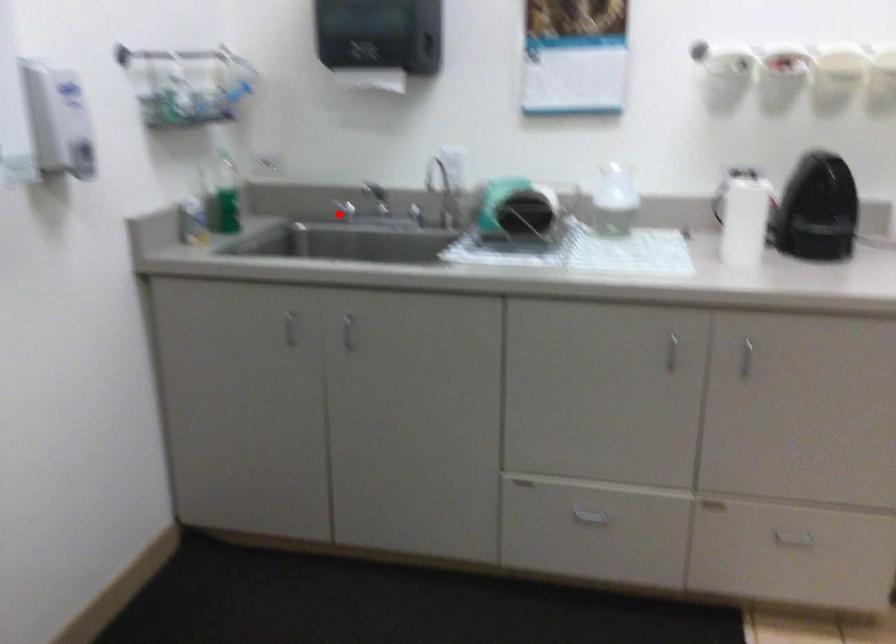
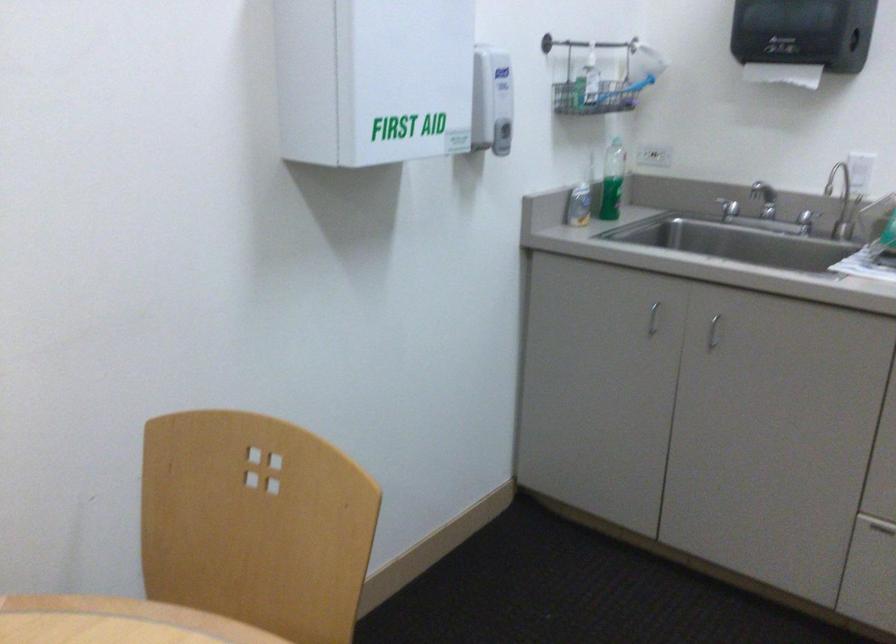
Locate, in the second image, the point that corresponds to the highlighted location in the first image.

(728, 207)